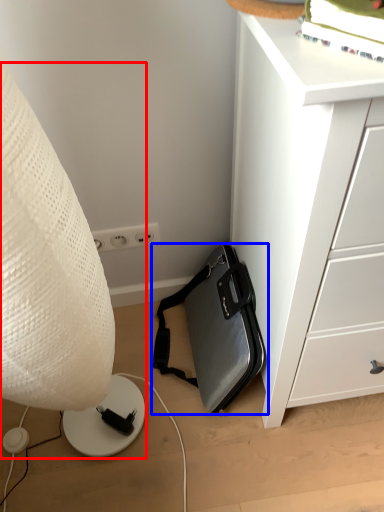
Question: Which object is closer to the camera taking this photo, lamp (highlighted by a red box) or luggage and bags (highlighted by a blue box)?

Choices:
 (A) lamp
 (B) luggage and bags

Answer: (A)